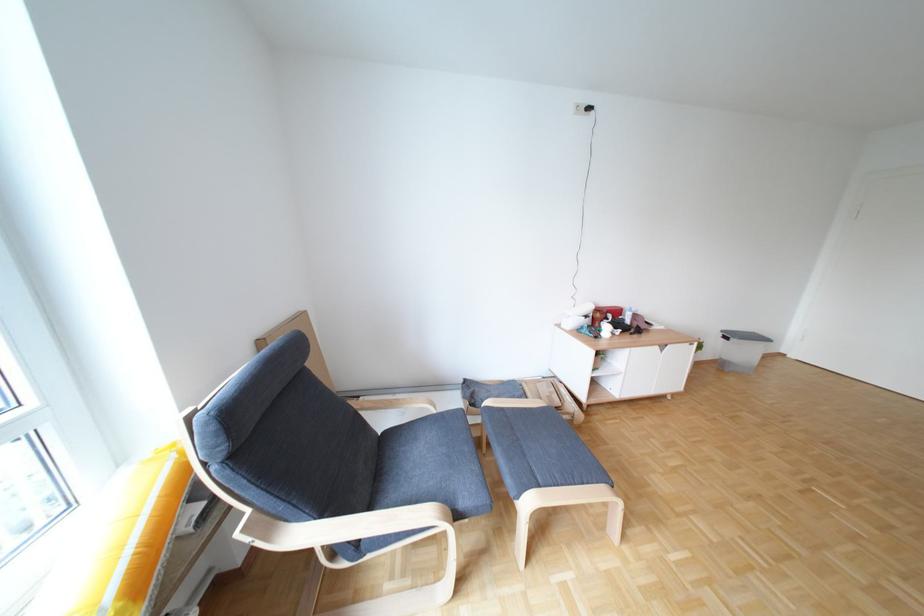
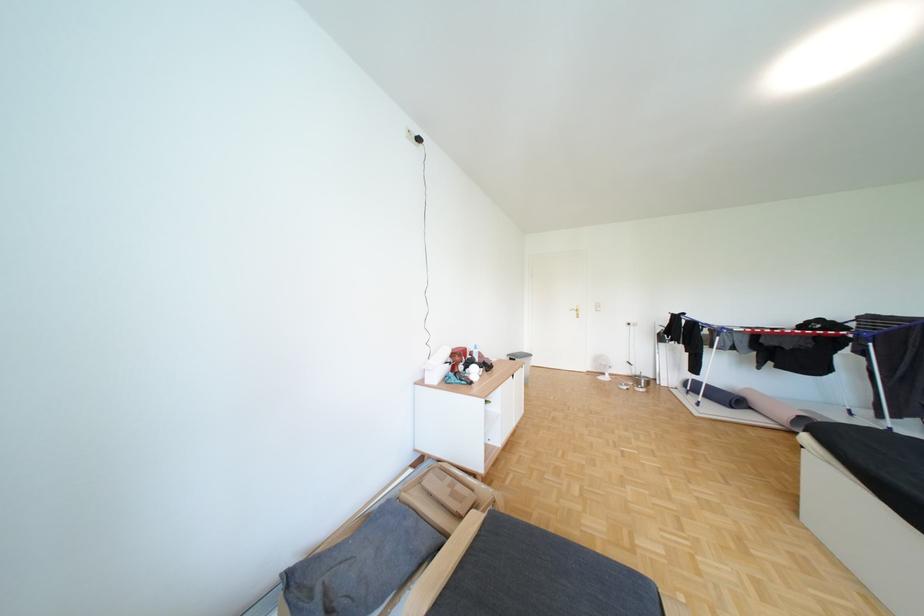
Question: The camera is either moving clockwise (left) or counter-clockwise (right) around the object. The first image is from the beginning of the video and the second image is from the end. Is the camera moving left or right when shooting the video?

Choices:
 (A) Left
 (B) Right

Answer: (A)